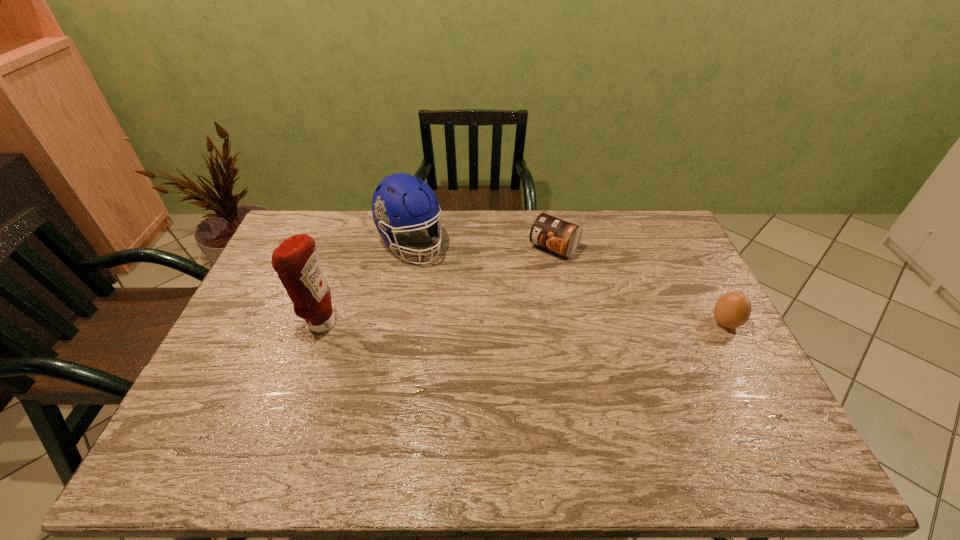
Identify the location of vacant space on the desktop that is between the condiment and the rightmost object and is positioned on the front label of the can. (485, 323).

Image resolution: width=960 pixels, height=540 pixels. In order to click on free space on the desktop that is between the condiment and the boiled egg and is positioned on the face guard of the second tallest object in this screenshot , I will do `click(484, 323)`.